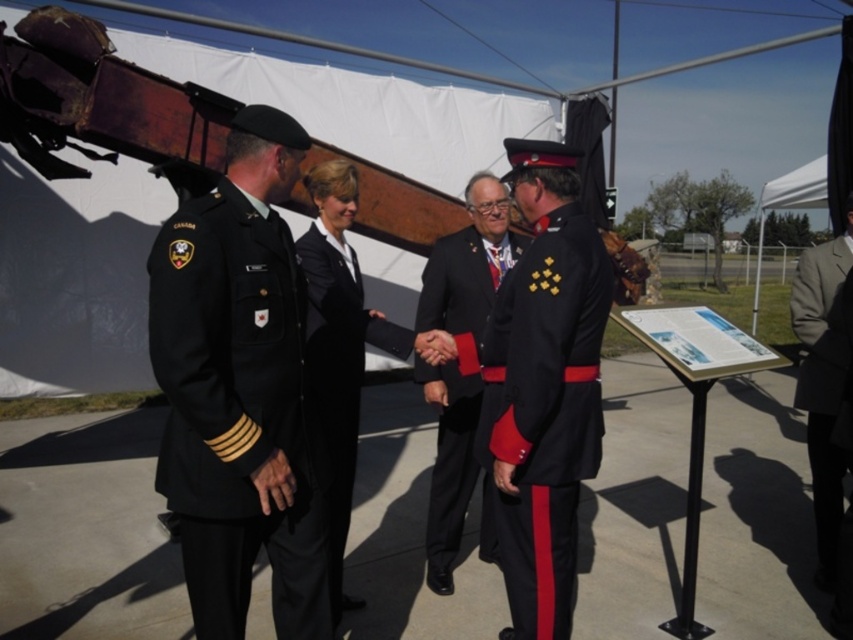
You are a photographer at this event and need to adjust your camera focus. Which of the two people in the black uniforms, the black wool military uniform at left or the shiny black uniform at center, is closer to you?

The black wool military uniform at left is closer to you because it is in front of the shiny black uniform at center.

You are attending a formal outdoor event and notice a point at coordinates (544, 412). Which object does this point correspond to?

The point at coordinates (544, 412) corresponds to the black satin uniform at center.